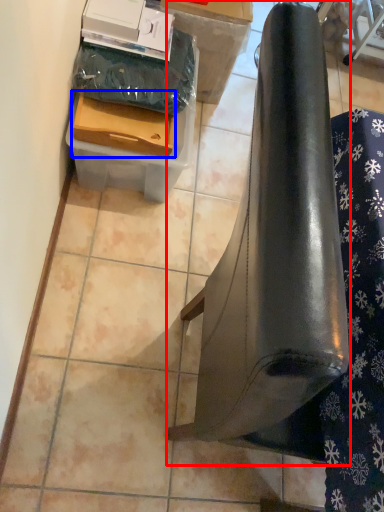
Question: Which object appears farthest to the camera in this image, furniture (highlighted by a red box) or drawer (highlighted by a blue box)?

Choices:
 (A) furniture
 (B) drawer

Answer: (B)